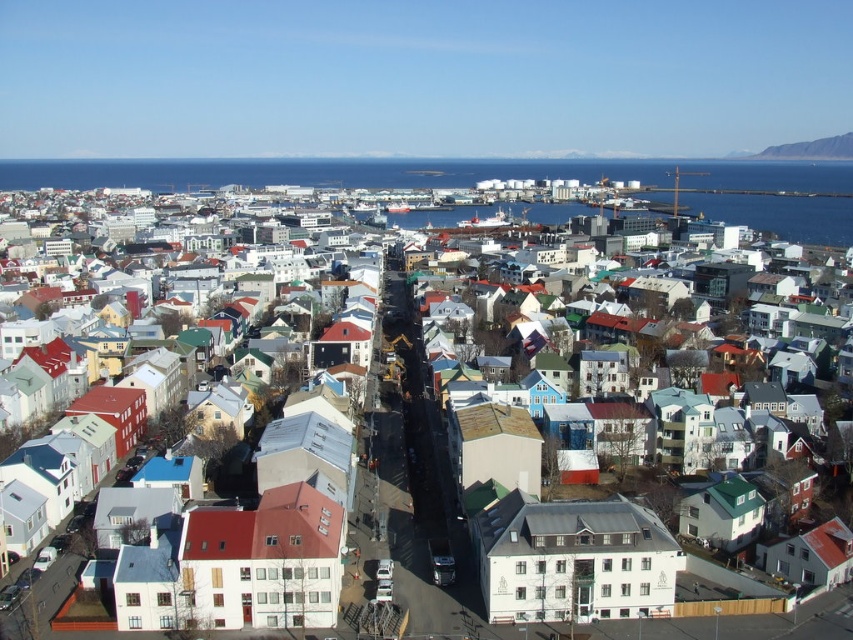
Question: Does blue water at upper left have a smaller size compared to white matte building at center?

Choices:
 (A) no
 (B) yes

Answer: (B)

Question: Which point is closer to the camera taking this photo?

Choices:
 (A) (538, 173)
 (B) (444, 444)
 (C) (784, 145)

Answer: (B)

Question: Which of the following is the closest to the observer?

Choices:
 (A) blue water at upper left
 (B) white matte building at center

Answer: (B)

Question: Does blue water at upper left have a lesser width compared to rugged rock cliff at upper right?

Choices:
 (A) yes
 (B) no

Answer: (B)

Question: Considering the real-world distances, which object is farthest from the rugged rock cliff at upper right?

Choices:
 (A) blue water at upper left
 (B) white matte building at center

Answer: (B)

Question: Is blue water at upper left thinner than rugged rock cliff at upper right?

Choices:
 (A) no
 (B) yes

Answer: (A)